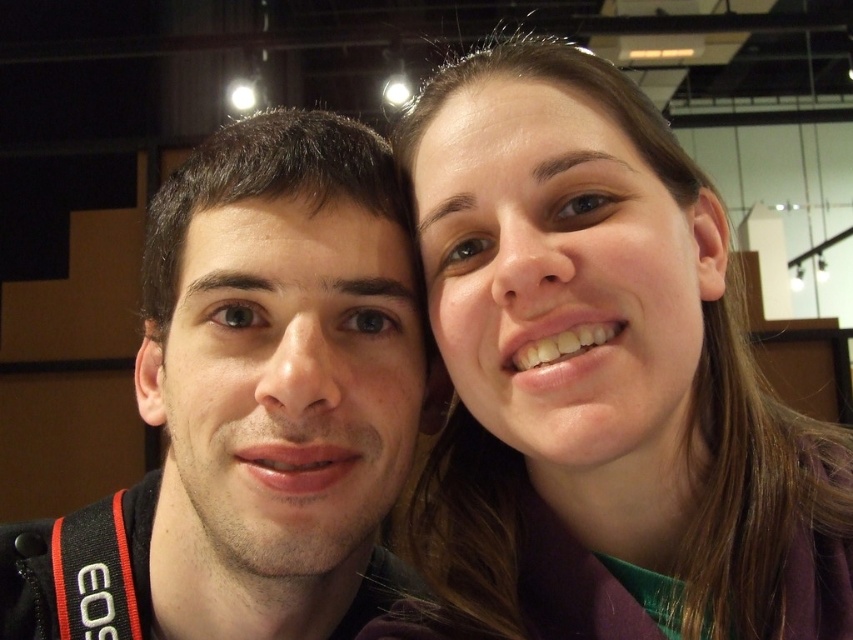
Who is positioned more to the right, smooth brown hair at upper right or matte black jacket at left?

smooth brown hair at upper right

Can you confirm if smooth brown hair at upper right is positioned below matte black jacket at left?

Incorrect, smooth brown hair at upper right is not positioned below matte black jacket at left.

Does point (479, 68) come farther from viewer compared to point (24, 534)?

No.

This screenshot has width=853, height=640. Find the location of `smooth brown hair at upper right`. smooth brown hair at upper right is located at coordinates (602, 378).